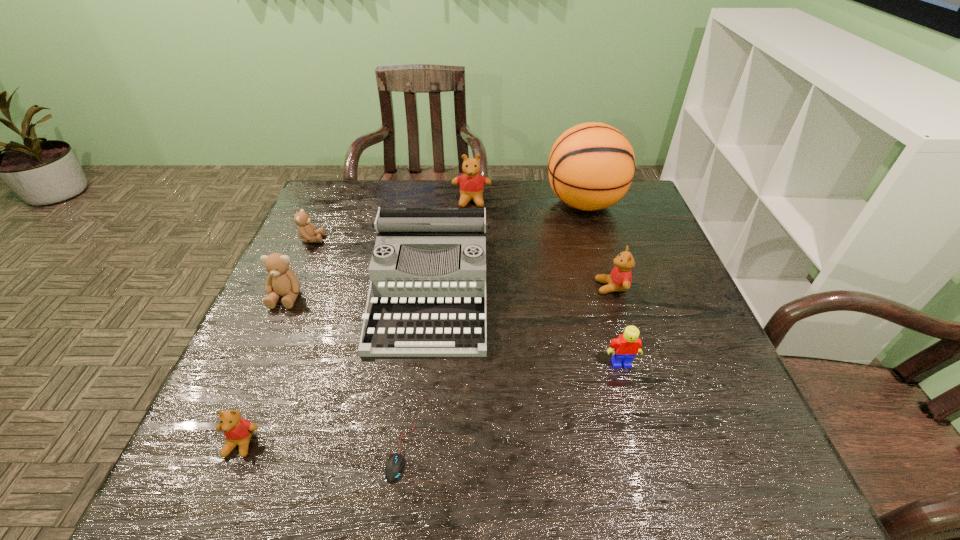
Where is `basketball that is at the right edge`? This screenshot has height=540, width=960. basketball that is at the right edge is located at coordinates (591, 166).

Identify the location of teddy bear located at the right edge. (620, 278).

This screenshot has height=540, width=960. I want to click on object at the near left corner, so click(238, 431).

Locate an element on the screen. object that is at the far right corner is located at coordinates (591, 166).

Find the location of a particular element. Image resolution: width=960 pixels, height=540 pixels. vacant space at the far edge of the desktop is located at coordinates (515, 194).

Where is `vacant space at the near edge of the desktop`? Image resolution: width=960 pixels, height=540 pixels. vacant space at the near edge of the desktop is located at coordinates (324, 460).

The height and width of the screenshot is (540, 960). In order to click on vacant space at the left edge in this screenshot , I will do `click(307, 298)`.

The width and height of the screenshot is (960, 540). I want to click on vacant space at the right edge, so click(662, 272).

You are a GUI agent. You are given a task and a screenshot of the screen. Output one action in this format:
    pyautogui.click(x=<x>, y=<y>)
    Task: Click on the free spot at the far left corner of the desktop
    The image size is (960, 540).
    Given the screenshot: What is the action you would take?
    pyautogui.click(x=336, y=197)

At what (x,y) coordinates should I click in order to perform the action: click on free space at the near left corner. Please return your answer as a coordinate pair (x, y). The width and height of the screenshot is (960, 540). Looking at the image, I should click on (243, 458).